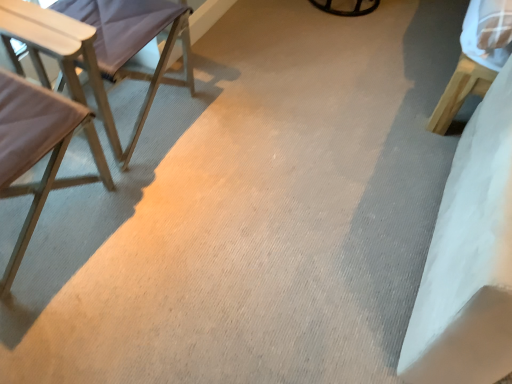
Question: Considering the positions of light beige fabric chair at left, the 2th chair in the top-to-bottom sequence, and light purple fabric chair at left, placed as the 2th chair when sorted from bottom to top, in the image, is light beige fabric chair at left, the 2th chair in the top-to-bottom sequence, bigger or smaller than light purple fabric chair at left, placed as the 2th chair when sorted from bottom to top,?

Choices:
 (A) small
 (B) big

Answer: (A)

Question: Looking at their shapes, would you say light beige fabric chair at left, the 2th chair in the top-to-bottom sequence, is wider or thinner than light purple fabric chair at left, the first chair when ordered from top to bottom?

Choices:
 (A) wide
 (B) thin

Answer: (B)

Question: Visually, is light beige fabric chair at left, the 2th chair in the top-to-bottom sequence, positioned to the left or to the right of light purple fabric chair at left, the first chair when ordered from top to bottom?

Choices:
 (A) right
 (B) left

Answer: (B)

Question: Looking at their shapes, would you say light purple fabric chair at left, placed as the 2th chair when sorted from bottom to top, is wider or thinner than light beige fabric chair at left, the 1th chair ordered from the bottom?

Choices:
 (A) thin
 (B) wide

Answer: (B)

Question: Looking at the image, does light purple fabric chair at left, placed as the 2th chair when sorted from bottom to top, seem bigger or smaller compared to light beige fabric chair at left, the 2th chair in the top-to-bottom sequence?

Choices:
 (A) small
 (B) big

Answer: (B)

Question: Relative to light beige fabric chair at left, the 2th chair in the top-to-bottom sequence, is light purple fabric chair at left, placed as the 2th chair when sorted from bottom to top, in front or behind?

Choices:
 (A) front
 (B) behind

Answer: (B)

Question: Choose the correct answer: Is light purple fabric chair at left, the first chair when ordered from top to bottom, inside light beige fabric chair at left, the 1th chair ordered from the bottom, or outside it?

Choices:
 (A) outside
 (B) inside

Answer: (A)